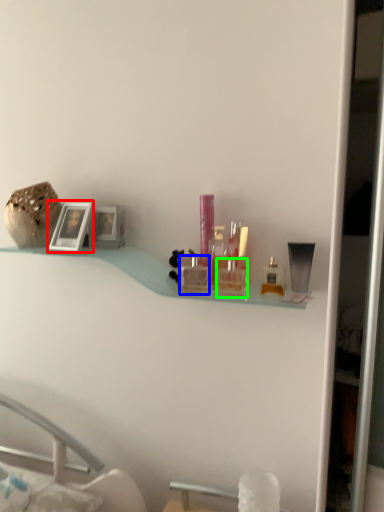
Question: Based on their relative distances, which object is farther from picture frame (highlighted by a red box)? Choose from toiletry (highlighted by a blue box) and toiletry (highlighted by a green box).

Choices:
 (A) toiletry
 (B) toiletry

Answer: (B)